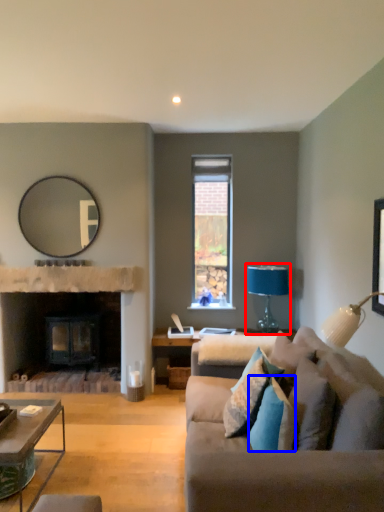
Question: Which object is closer to the camera taking this photo, table lamp (highlighted by a red box) or pillow (highlighted by a blue box)?

Choices:
 (A) table lamp
 (B) pillow

Answer: (B)